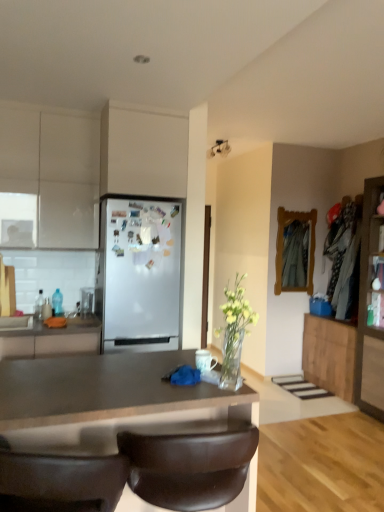
Question: Is brown leather chair at lower center oriented away from wooden cabinet at right, positioned as the 1th cabinetry in right-to-left order?

Choices:
 (A) no
 (B) yes

Answer: (A)

Question: Is brown leather chair at lower center far away from wooden cabinet at right, the fifth cabinetry positioned from the left?

Choices:
 (A) no
 (B) yes

Answer: (B)

Question: From a real-world perspective, is brown leather chair at lower center located beneath wooden cabinet at right, positioned as the 1th cabinetry in right-to-left order?

Choices:
 (A) no
 (B) yes

Answer: (B)

Question: Is brown leather chair at lower center placed right next to wooden cabinet at right, positioned as the 1th cabinetry in right-to-left order?

Choices:
 (A) yes
 (B) no

Answer: (B)

Question: Is brown leather chair at lower center oriented towards wooden cabinet at right, the fifth cabinetry positioned from the left?

Choices:
 (A) no
 (B) yes

Answer: (A)

Question: From the image's perspective, is wooden cabinet at right, acting as the 4th cabinetry starting from the left, located above or below white matte refrigerator at center?

Choices:
 (A) above
 (B) below

Answer: (B)

Question: Looking at the image, does wooden cabinet at right, acting as the 4th cabinetry starting from the left, seem bigger or smaller compared to white matte refrigerator at center?

Choices:
 (A) small
 (B) big

Answer: (A)

Question: In the image, is wooden cabinet at right, which is the 2th cabinetry from right to left, positioned in front of or behind white matte refrigerator at center?

Choices:
 (A) front
 (B) behind

Answer: (B)

Question: From their relative heights in the image, would you say wooden cabinet at right, which is the 2th cabinetry from right to left, is taller or shorter than white matte refrigerator at center?

Choices:
 (A) short
 (B) tall

Answer: (A)

Question: From a real-world perspective, is wooden cabinet at right, positioned as the 1th cabinetry in right-to-left order, above or below matte white cabinet at upper center, arranged as the third cabinetry when viewed from the left?

Choices:
 (A) above
 (B) below

Answer: (B)

Question: Is wooden cabinet at right, the fifth cabinetry positioned from the left, situated inside matte white cabinet at upper center, arranged as the third cabinetry when viewed from the left, or outside?

Choices:
 (A) inside
 (B) outside

Answer: (B)

Question: Relative to matte white cabinet at upper center, acting as the 3th cabinetry starting from the right, is wooden cabinet at right, the fifth cabinetry positioned from the left, in front or behind?

Choices:
 (A) front
 (B) behind

Answer: (B)

Question: Looking at their shapes, would you say wooden cabinet at right, the fifth cabinetry positioned from the left, is wider or thinner than matte white cabinet at upper center, acting as the 3th cabinetry starting from the right?

Choices:
 (A) thin
 (B) wide

Answer: (A)

Question: Visually, is brown leather chair at lower center positioned to the left or to the right of wooden cabinet at right, which is the 2th cabinetry from right to left?

Choices:
 (A) left
 (B) right

Answer: (A)

Question: Which is correct: brown leather chair at lower center is inside wooden cabinet at right, acting as the 4th cabinetry starting from the left, or outside of it?

Choices:
 (A) inside
 (B) outside

Answer: (B)